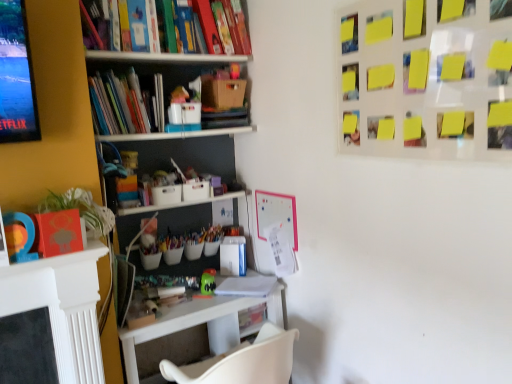
Question: Considering the positions of green leafy plant at left and brown cardboard box at upper center in the image, is green leafy plant at left wider or thinner than brown cardboard box at upper center?

Choices:
 (A) wide
 (B) thin

Answer: (B)

Question: Relative to brown cardboard box at upper center, is green leafy plant at left in front or behind?

Choices:
 (A) behind
 (B) front

Answer: (B)

Question: Estimate the real-world distances between objects in this image. Which object is farther from the brown cardboard box at upper center?

Choices:
 (A) green matte toy at center
 (B) hardcover books at left
 (C) green leafy plant at left
 (D) yellow sticky notes at upper right
 (E) white plastic table at lower left

Answer: (E)

Question: Which is nearer to the white plastic table at lower left?

Choices:
 (A) yellow sticky notes at upper right
 (B) hardcover books at left
 (C) green leafy plant at left
 (D) brown cardboard box at upper center
 (E) green matte toy at center

Answer: (E)